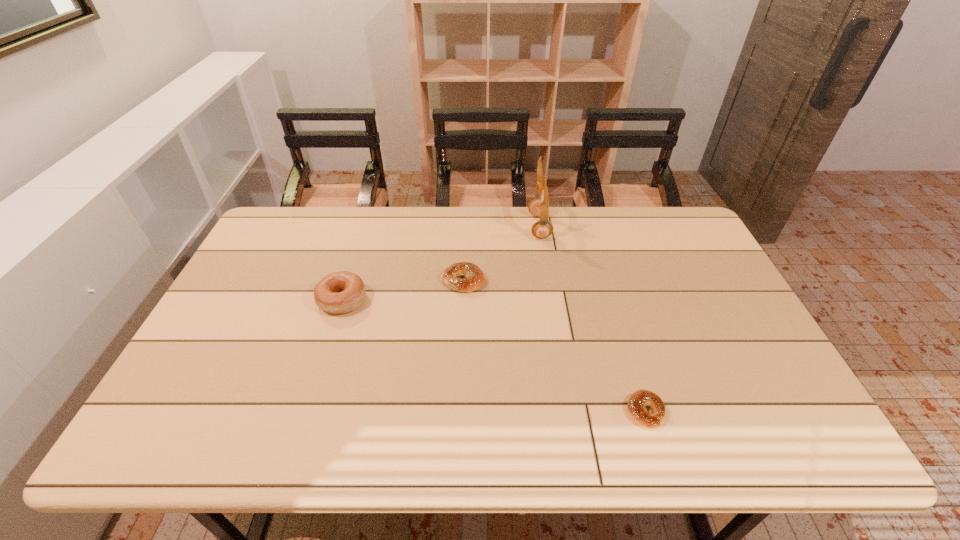
The height and width of the screenshot is (540, 960). In order to click on vacant space located 0.380m on the front-facing side of the farthest object in this screenshot , I will do `click(420, 227)`.

The width and height of the screenshot is (960, 540). I want to click on free space located on the back of the tallest bagel, so click(367, 221).

At what (x,y) coordinates should I click in order to perform the action: click on vacant space located on the left of the second object from left to right. Please return your answer as a coordinate pair (x, y). Looking at the image, I should click on (419, 280).

Identify the location of free region located 0.160m on the back of the shortest object. (624, 341).

The image size is (960, 540). I want to click on object that is at the far edge, so click(539, 207).

Find the location of `object situated at the near edge`. object situated at the near edge is located at coordinates (639, 399).

Locate an element on the screen. Image resolution: width=960 pixels, height=540 pixels. vacant space at the far edge is located at coordinates (329, 206).

Find the location of a particular element. The image size is (960, 540). vacant space at the near edge is located at coordinates (338, 417).

The width and height of the screenshot is (960, 540). In the image, there is a desktop. What are the coordinates of `vacant area at the left edge` in the screenshot? It's located at (186, 388).

Locate an element on the screen. The height and width of the screenshot is (540, 960). free space at the right edge of the desktop is located at coordinates (722, 316).